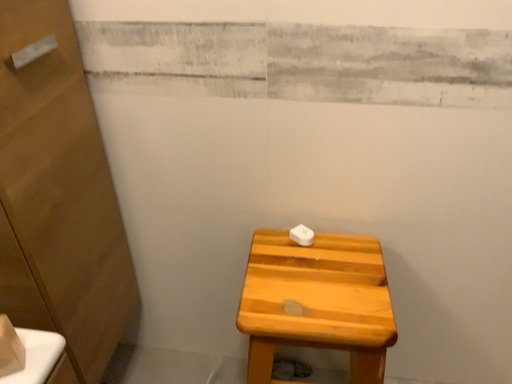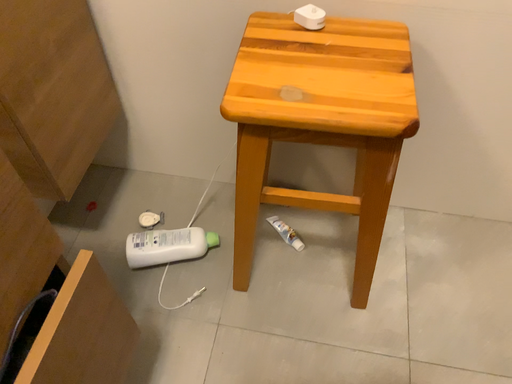
Question: How did the camera likely rotate when shooting the video?

Choices:
 (A) rotated upward
 (B) rotated downward

Answer: (B)